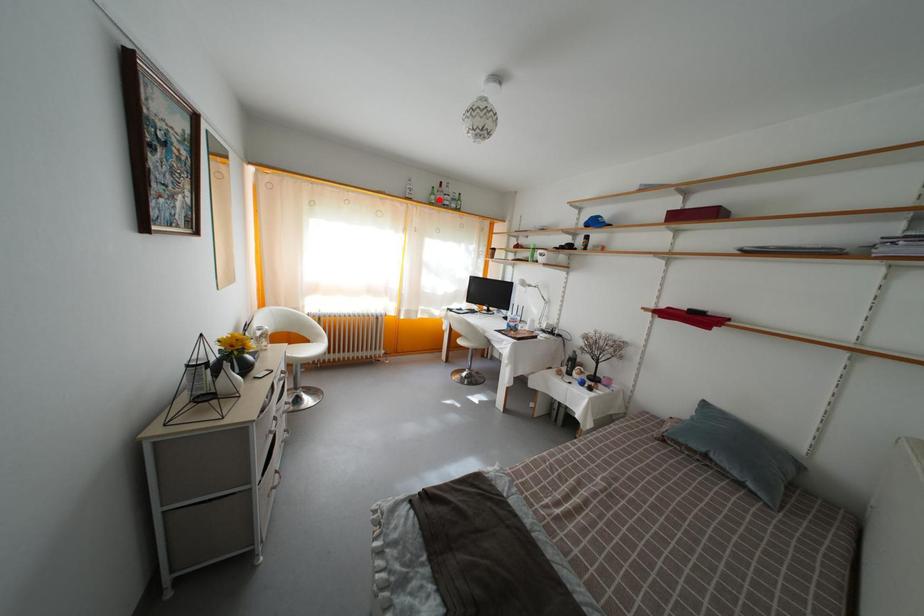
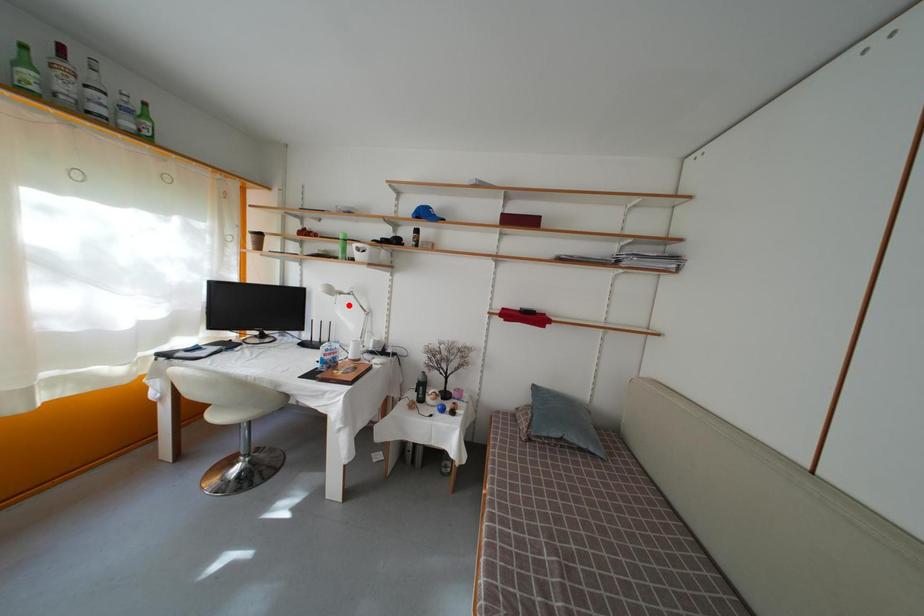
I am providing you with two images of the same scene from different viewpoints. A red point is marked on the first image and another point is marked on the second image. Does the point marked in image1 correspond to the same location as the one in image2?

No